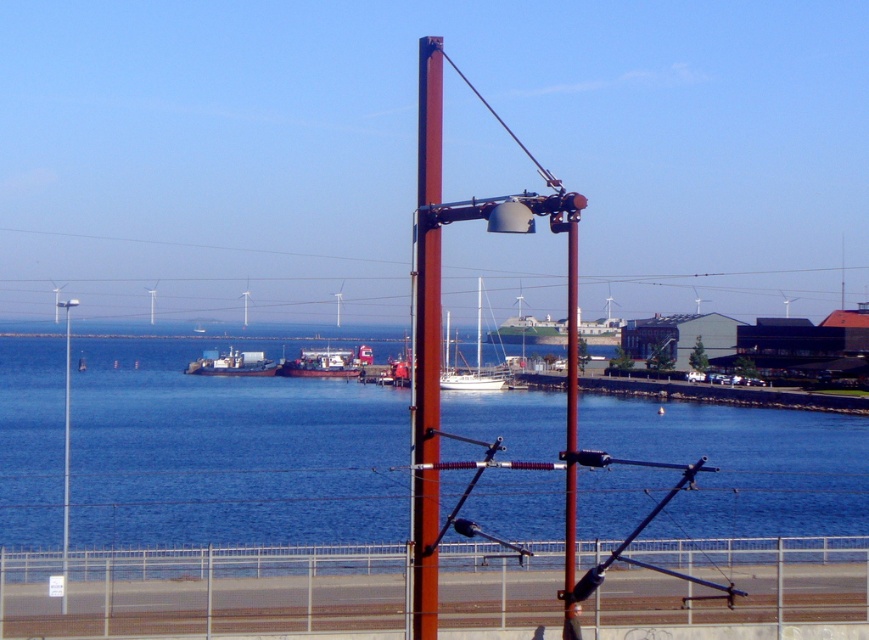
You are standing at the point marked by the coordinates point (322, 364). What object are you standing on?

The point (322, 364) indicates the white plastic boat at center, so you are standing on the white plastic boat at center.

You are standing on the dock and see both the white plastic boat at center and the white glossy sailboat at center. Which boat is closer to you?

The white plastic boat at center is closer to you because it is positioned further to the viewer compared to the white glossy sailboat at center.

You are standing at the red utility pole in the coastal scene. You notice two points marked in the image. Which point, point (267, 369) or point (479, 292), is nearer to your current position?

Point (267, 369) is closer to the camera than point (479, 292), so it is nearer to your current position at the red utility pole.